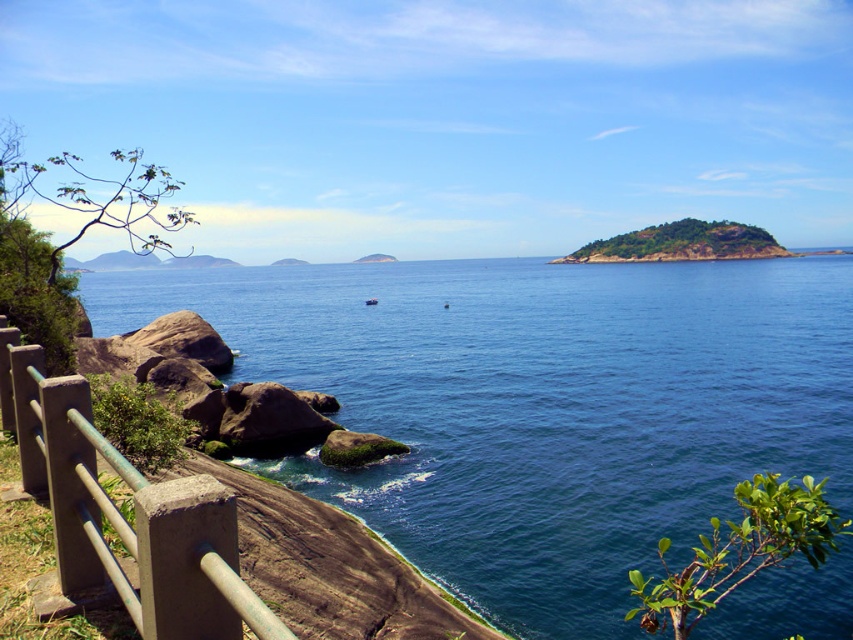
Is deep blue water at center closer to the viewer compared to green concrete railing at lower left?

No, it is behind green concrete railing at lower left.

Who is lower down, deep blue water at center or green concrete railing at lower left?

green concrete railing at lower left

Between point (392, 545) and point (62, 572), which one is positioned in front?

Point (62, 572) is in front.

Locate an element on the screen. The width and height of the screenshot is (853, 640). deep blue water at center is located at coordinates (538, 404).

Is deep blue water at center to the right of green mossy rock at center from the viewer's perspective?

In fact, deep blue water at center is to the left of green mossy rock at center.

Which is in front, point (740, 328) or point (674, 221)?

Point (740, 328) is in front.

The image size is (853, 640). Identify the location of deep blue water at center. (538, 404).

Does point (74, 486) come farther from viewer compared to point (674, 243)?

No, (74, 486) is in front of (674, 243).

Where is `green concrete railing at lower left`? This screenshot has height=640, width=853. green concrete railing at lower left is located at coordinates (123, 516).

Find the location of a particular element. green concrete railing at lower left is located at coordinates (123, 516).